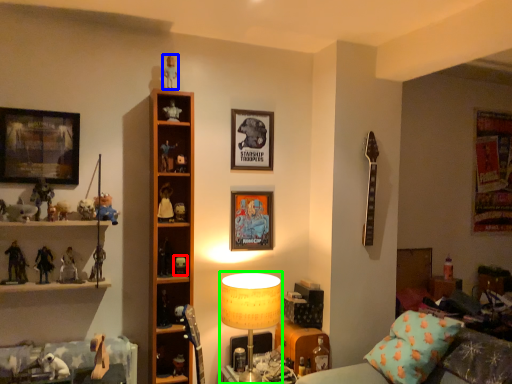
Question: Estimate the real-world distances between objects in this image. Which object is closer to toy (highlighted by a red box), toy (highlighted by a blue box) or table lamp (highlighted by a green box)?

Choices:
 (A) toy
 (B) table lamp

Answer: (B)